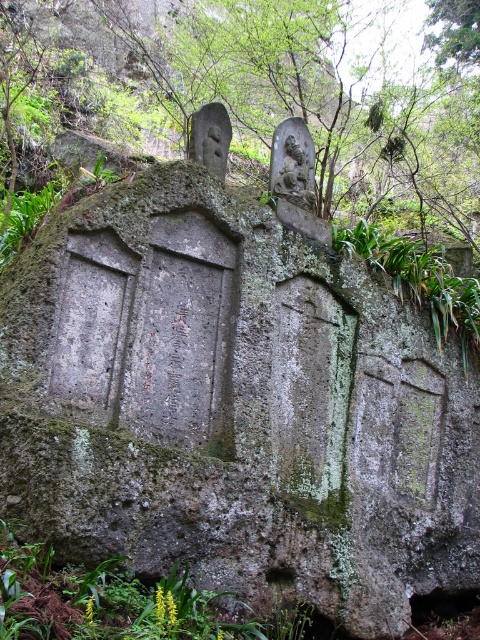
You are a hiker who has stumbled upon this monument in the forest. You notice the green mossy rock at center and the carved stone statue at center. Which object would you need to move if you wanted to place a small offering on the monument? Explain your reasoning.

The green mossy rock at center has a larger size compared to the carved stone statue at center. Since the rock is bigger, it would occupy more space on the monument, making it the object to move for placing a small offering.

Based on the photo, you are a hiker who wants to place a small backpack between the green leafy plants at lower left and the carved stone statue at center. Can you fit it there?

The green leafy plants at lower left are wider than the carved stone statue at center. Since the plants are wider, the space between them might be narrower, so the backpack may not fit comfortably.

You are a hiker who has stumbled upon this monument in the forest. You notice the green leafy plants at lower left and the carved stone statue at center. Which object is positioned lower in the image?

The green leafy plants at lower left are positioned lower than the carved stone statue at center.